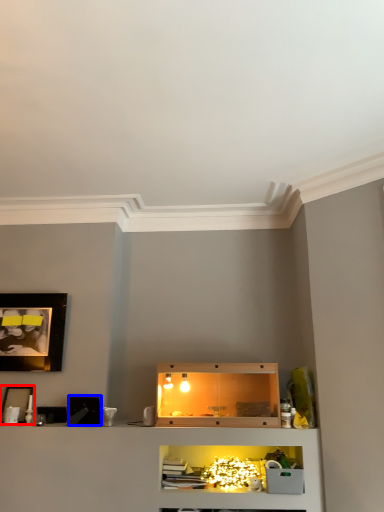
Question: Which of the following is the farthest to the observer, picture frame (highlighted by a red box) or picture frame (highlighted by a blue box)?

Choices:
 (A) picture frame
 (B) picture frame

Answer: (A)